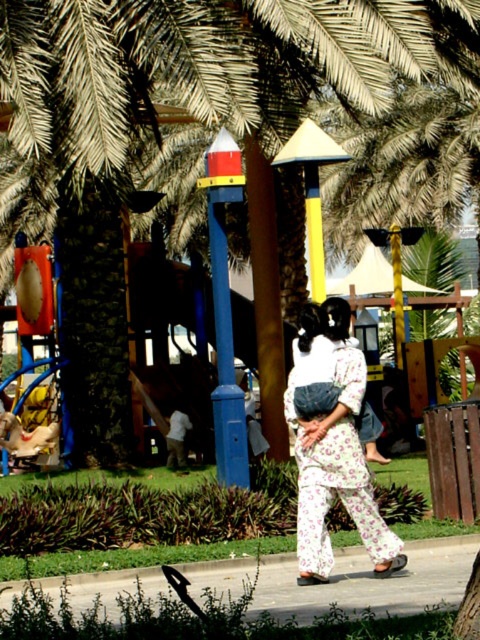
Question: Can you confirm if green leafy palm tree at center is positioned below floral cotton kimono at center?

Choices:
 (A) no
 (B) yes

Answer: (A)

Question: Does green leafy palm tree at center have a smaller size compared to floral cotton kimono at center?

Choices:
 (A) yes
 (B) no

Answer: (B)

Question: Which of the following is the farthest from the observer?

Choices:
 (A) (368, 509)
 (B) (100, 29)

Answer: (B)

Question: Which point is closer to the camera?

Choices:
 (A) (79, 67)
 (B) (342, 330)

Answer: (B)

Question: Does green leafy palm tree at center have a lesser width compared to floral cotton kimono at center?

Choices:
 (A) yes
 (B) no

Answer: (B)